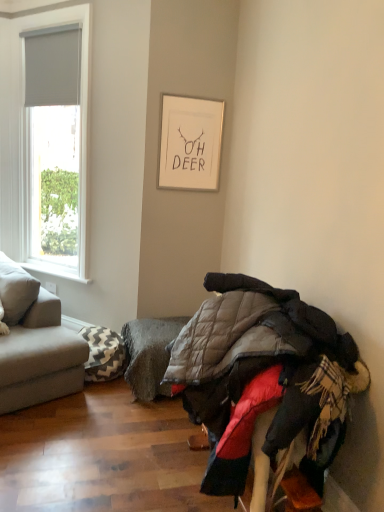
At what (x,y) coordinates should I click in order to perform the action: click on vacant point above white matte picture frame at upper center (from a real-world perspective). Please return your answer as a coordinate pair (x, y). Looking at the image, I should click on (195, 92).